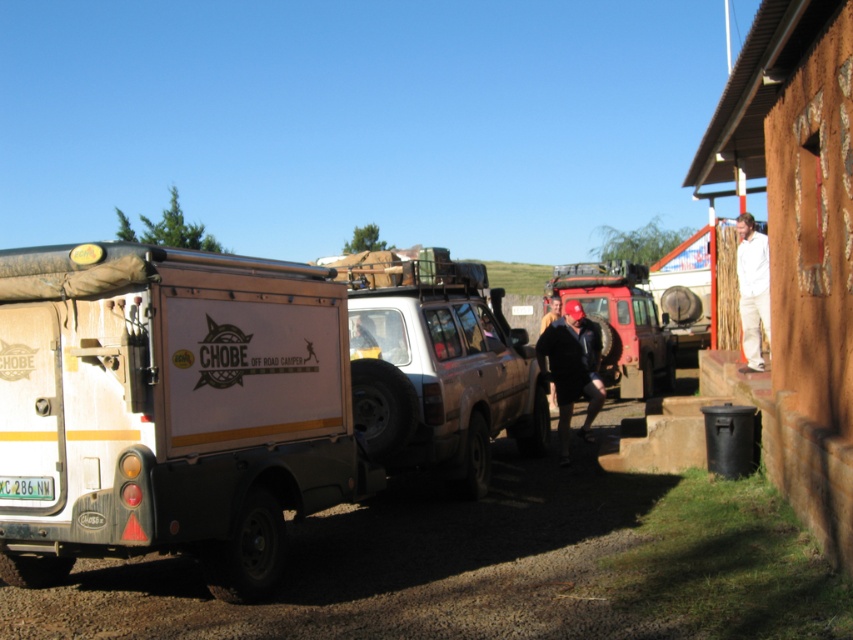
In the scene shown: Is dark blue jeans at center taller than brown leather jacket at center?

Yes, dark blue jeans at center is taller than brown leather jacket at center.

Is dark blue jeans at center in front of brown leather jacket at center?

Yes, dark blue jeans at center is in front of brown leather jacket at center.

This screenshot has height=640, width=853. Identify the location of dark blue jeans at center. (572, 369).

The height and width of the screenshot is (640, 853). What are the coordinates of `dark blue jeans at center` in the screenshot? It's located at (572, 369).

Does matte white camper at center come in front of brown leather jacket at center?

Yes, matte white camper at center is closer to the viewer.

Who is positioned more to the left, matte white camper at center or brown leather jacket at center?

Positioned to the left is matte white camper at center.

Is point (125, 444) positioned after point (543, 323)?

No, it is in front of (543, 323).

Identify the location of matte white camper at center. (169, 410).

Is matte beige suv at center to the right of dark blue jeans at center from the viewer's perspective?

Incorrect, matte beige suv at center is not on the right side of dark blue jeans at center.

From the picture: Who is taller, matte beige suv at center or dark blue jeans at center?

matte beige suv at center is taller.

What do you see at coordinates (437, 365) in the screenshot? The image size is (853, 640). I see `matte beige suv at center` at bounding box center [437, 365].

Where is `matte beige suv at center`? The height and width of the screenshot is (640, 853). matte beige suv at center is located at coordinates (437, 365).